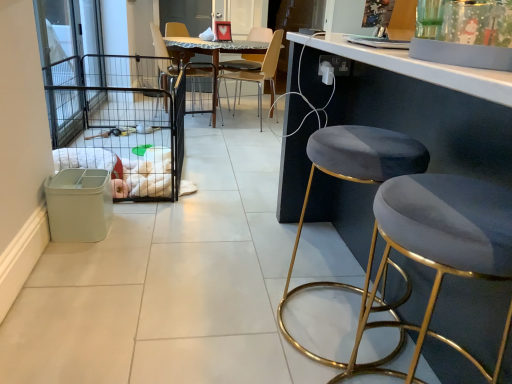
Locate an element on the screen. vacant region to the left of velvet/golden stool at right, positioned as the second stool in front-to-back order is located at coordinates (222, 308).